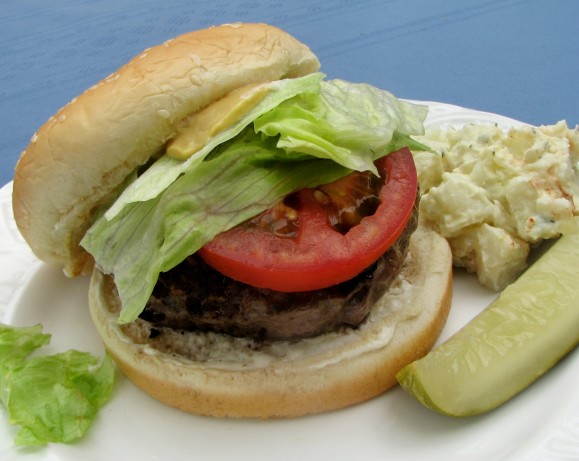
Locate an element on the screen. plate is located at coordinates (331, 422).